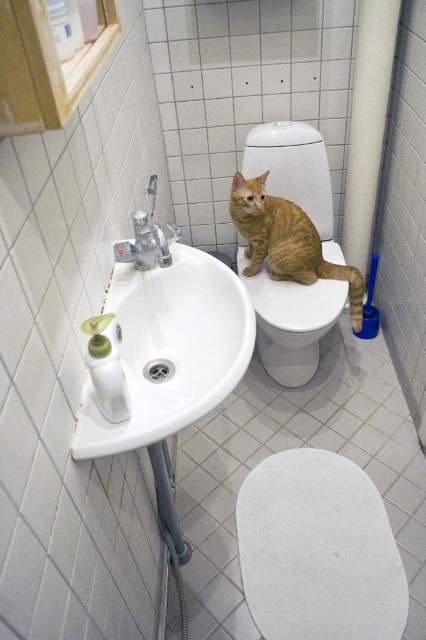
Question: Does white glossy sink at lower left have a smaller size compared to orange tabby cat at center?

Choices:
 (A) yes
 (B) no

Answer: (A)

Question: Does white glossy sink at lower left appear on the right side of orange tabby cat at center?

Choices:
 (A) no
 (B) yes

Answer: (A)

Question: Based on their relative distances, which object is nearer to the white glossy sink at lower left?

Choices:
 (A) white matte toilet seat at center
 (B) orange tabby cat at center
 (C) satin nickel faucet at sink left

Answer: (C)

Question: Which is farther from the white matte toilet seat at center?

Choices:
 (A) white glossy sink at lower left
 (B) orange tabby cat at center

Answer: (A)

Question: Which of the following is the farthest from the observer?

Choices:
 (A) (149, 228)
 (B) (322, 262)
 (C) (201, 316)

Answer: (B)

Question: Is white glossy sink at lower left to the right of orange tabby cat at center from the viewer's perspective?

Choices:
 (A) no
 (B) yes

Answer: (A)